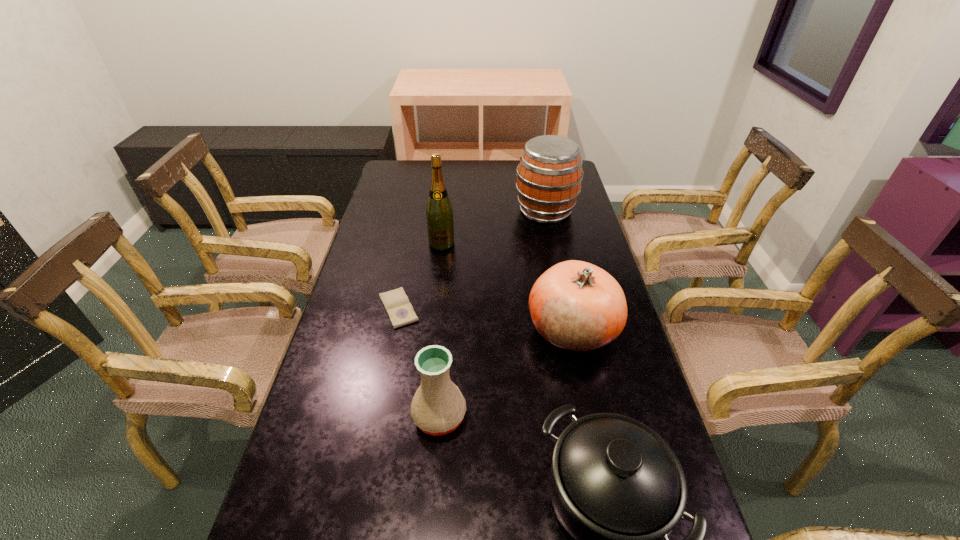
I want to click on the second farthest object, so click(x=439, y=213).

This screenshot has height=540, width=960. I want to click on the tallest object, so click(439, 213).

Where is `the farthest object`? the farthest object is located at coordinates (549, 175).

Find the location of `pumpkin`. pumpkin is located at coordinates (576, 306).

This screenshot has height=540, width=960. Find the location of `pottery`. pottery is located at coordinates (438, 407).

Find the location of a particular element. The height and width of the screenshot is (540, 960). the shortest object is located at coordinates (400, 311).

Where is `vacant space located on the front-facing side of the wine bottle`? vacant space located on the front-facing side of the wine bottle is located at coordinates (433, 325).

Identify the location of free region located 0.300m on the back of the farthest object. Image resolution: width=960 pixels, height=540 pixels. (536, 161).

Locate an element on the screen. The width and height of the screenshot is (960, 540). vacant space located 0.370m on the left of the pumpkin is located at coordinates (395, 329).

Identify the location of vacant region located on the right of the pottery. This screenshot has width=960, height=540. (543, 416).